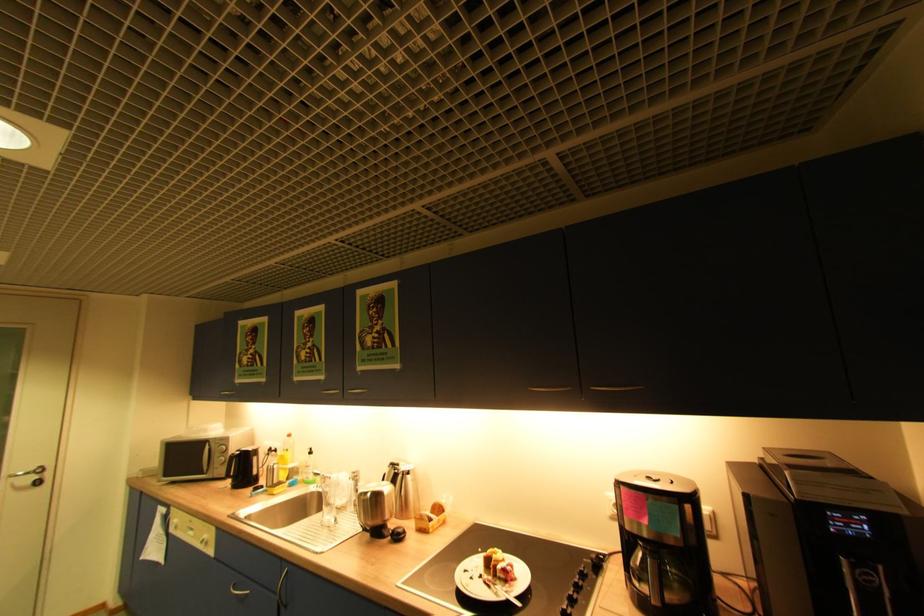
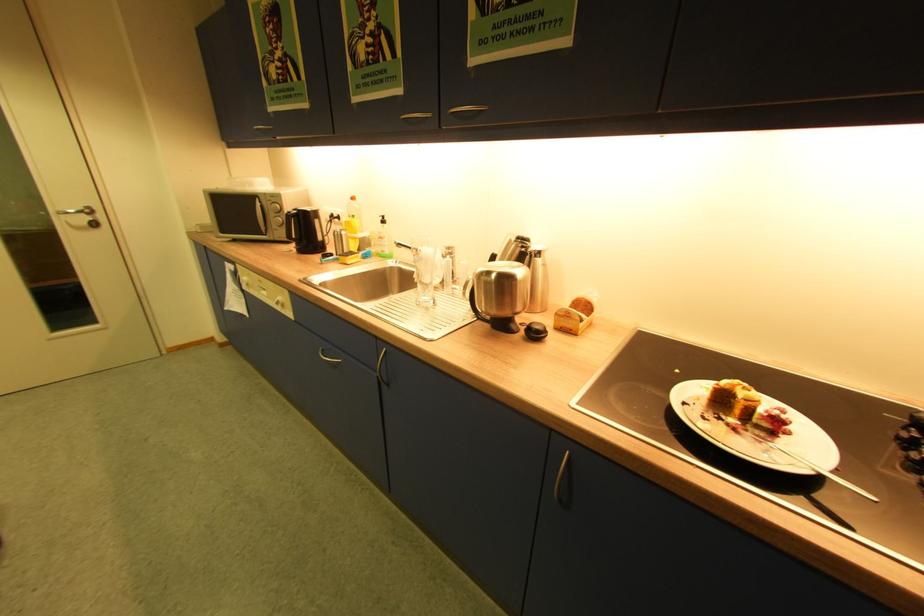
Where in the second image is the point corresponding to [415,477] from the first image?

(543, 261)